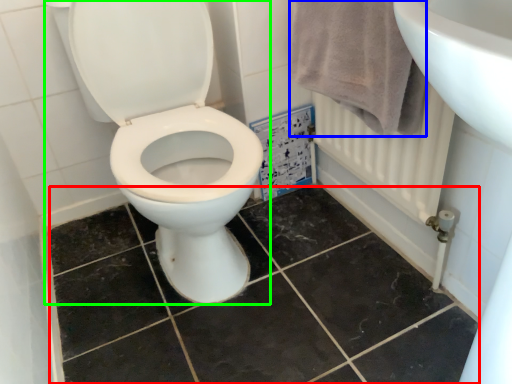
Question: Which object is positioned farthest from ceramic tile (highlighted by a red box)? Select from bath towel (highlighted by a blue box) and toilet (highlighted by a green box).

Choices:
 (A) bath towel
 (B) toilet

Answer: (A)